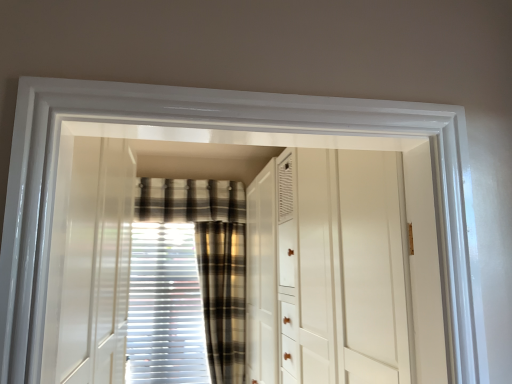
This screenshot has width=512, height=384. What do you see at coordinates (188, 282) in the screenshot?
I see `white textured blinds at center, acting as the 1th curtain starting from the left` at bounding box center [188, 282].

What do you see at coordinates (190, 200) in the screenshot? This screenshot has width=512, height=384. I see `plaid fabric at center` at bounding box center [190, 200].

Looking at this image, measure the distance between plaid fabric curtain at center, which is the 2th curtain in left-to-right order, and camera.

The depth of plaid fabric curtain at center, which is the 2th curtain in left-to-right order, is 3.15 meters.

Describe the element at coordinates (344, 269) in the screenshot. The width and height of the screenshot is (512, 384). I see `white glossy dresser at center` at that location.

You are a GUI agent. You are given a task and a screenshot of the screen. Output one action in this format:
    pyautogui.click(x=<x>, y=<y>)
    Task: Click on the white glossy dresser at center
    This screenshot has width=512, height=384.
    Given the screenshot: What is the action you would take?
    pyautogui.click(x=344, y=269)

The image size is (512, 384). I want to click on white textured blinds at center, acting as the 1th curtain starting from the left, so click(x=188, y=282).

Which object is further away from the camera, plaid fabric curtain at center, the first curtain from the right, or white textured blinds at center, acting as the 1th curtain starting from the left?

white textured blinds at center, acting as the 1th curtain starting from the left, is further from the camera.

Would you consider plaid fabric curtain at center, which is the 2th curtain in left-to-right order, to be distant from white textured blinds at center, acting as the 1th curtain starting from the left?

That's not correct — plaid fabric curtain at center, which is the 2th curtain in left-to-right order, is a little close to white textured blinds at center, acting as the 1th curtain starting from the left.

Can you confirm if plaid fabric curtain at center, which is the 2th curtain in left-to-right order, is shorter than white textured blinds at center, the 2th curtain when ordered from right to left?

No.

Does plaid fabric curtain at center, the first curtain from the right, have a greater width compared to white textured blinds at center, the 2th curtain when ordered from right to left?

Indeed, plaid fabric curtain at center, the first curtain from the right, has a greater width compared to white textured blinds at center, the 2th curtain when ordered from right to left.

Is white glossy dresser at center not within white textured blinds at center, the 2th curtain when ordered from right to left?

Indeed, white glossy dresser at center is completely outside white textured blinds at center, the 2th curtain when ordered from right to left.

Between white glossy dresser at center and white textured blinds at center, the 2th curtain when ordered from right to left, which one appears on the right side from the viewer's perspective?

From the viewer's perspective, white glossy dresser at center appears more on the right side.

Looking at the image, does white glossy dresser at center seem bigger or smaller compared to white textured blinds at center, the 2th curtain when ordered from right to left?

Considering their sizes, white glossy dresser at center takes up more space than white textured blinds at center, the 2th curtain when ordered from right to left.

From the image's perspective, which is above, white glossy dresser at center or white textured blinds at center, the 2th curtain when ordered from right to left?

white glossy dresser at center is shown above in the image.

Is white glossy dresser at center not within plaid fabric at center?

Indeed, white glossy dresser at center is completely outside plaid fabric at center.

Which object is wider, white glossy dresser at center or plaid fabric at center?

With larger width is white glossy dresser at center.

From a real-world perspective, between white glossy dresser at center and plaid fabric at center, who is vertically lower?

white glossy dresser at center is physically lower.

Does point (372, 328) appear closer or farther from the camera than point (200, 195)?

Point (372, 328) appears to be closer to the viewer than point (200, 195).

Is plaid fabric at center in contact with white glossy dresser at center?

plaid fabric at center is not next to white glossy dresser at center, and they're not touching.

From the image's perspective, would you say plaid fabric at center is positioned over white glossy dresser at center?

Yes, from the image's perspective, plaid fabric at center is on top of white glossy dresser at center.

Considering the sizes of plaid fabric at center and white glossy dresser at center in the image, is plaid fabric at center bigger or smaller than white glossy dresser at center?

plaid fabric at center is smaller than white glossy dresser at center.

Is plaid fabric at center further to camera compared to white glossy dresser at center?

Yes, plaid fabric at center is behind white glossy dresser at center.

Is white glossy dresser at center further to camera compared to plaid fabric curtain at center, the first curtain from the right?

No, white glossy dresser at center is closer to the camera.

At what (x,y) coordinates should I click in order to perform the action: click on the 1st curtain below the white glossy dresser at center (from the image's perspective). Please return your answer as a coordinate pair (x, y). Looking at the image, I should click on (223, 296).

Can you confirm if white glossy dresser at center is wider than plaid fabric curtain at center, the first curtain from the right?

Indeed, white glossy dresser at center has a greater width compared to plaid fabric curtain at center, the first curtain from the right.

How many degrees apart are the facing directions of white glossy dresser at center and plaid fabric curtain at center, the first curtain from the right?

The angular difference between white glossy dresser at center and plaid fabric curtain at center, the first curtain from the right, is 90 degrees.

Is white textured blinds at center, the 2th curtain when ordered from right to left, oriented away from plaid fabric at center?

No.

Which object is closer to the camera, white textured blinds at center, acting as the 1th curtain starting from the left, or plaid fabric at center?

white textured blinds at center, acting as the 1th curtain starting from the left, is in front.

From their relative heights in the image, would you say white textured blinds at center, acting as the 1th curtain starting from the left, is taller or shorter than plaid fabric at center?

Considering their sizes, white textured blinds at center, acting as the 1th curtain starting from the left, has more height than plaid fabric at center.

How different are the orientations of plaid fabric at center and plaid fabric curtain at center, the first curtain from the right, in degrees?

They differ by 0.000267 degrees in their facing directions.

Which of these two, plaid fabric at center or plaid fabric curtain at center, which is the 2th curtain in left-to-right order, is thinner?

Thinner between the two is plaid fabric at center.

From the image's perspective, does plaid fabric at center appear higher than plaid fabric curtain at center, which is the 2th curtain in left-to-right order?

Indeed, from the image's perspective, plaid fabric at center is shown above plaid fabric curtain at center, which is the 2th curtain in left-to-right order.

From their relative heights in the image, would you say plaid fabric at center is taller or shorter than plaid fabric curtain at center, the first curtain from the right?

Clearly, plaid fabric at center is shorter compared to plaid fabric curtain at center, the first curtain from the right.

You are a GUI agent. You are given a task and a screenshot of the screen. Output one action in this format:
    pyautogui.click(x=<x>, y=<y>)
    Task: Click on the curtain that appears on the left of plaid fabric curtain at center, which is the 2th curtain in left-to-right order
    
    Given the screenshot: What is the action you would take?
    pyautogui.click(x=188, y=282)

This screenshot has height=384, width=512. In order to click on the 2nd curtain positioned below the white glossy dresser at center (from the image's perspective) in this screenshot , I will do [188, 282].

Which object lies further to the anchor point white textured blinds at center, acting as the 1th curtain starting from the left, plaid fabric curtain at center, which is the 2th curtain in left-to-right order, or white glossy dresser at center?

Based on the image, white glossy dresser at center appears to be further to white textured blinds at center, acting as the 1th curtain starting from the left.

Which object lies further to the anchor point white glossy dresser at center, plaid fabric at center or white textured blinds at center, acting as the 1th curtain starting from the left?

Among the two, plaid fabric at center is located further to white glossy dresser at center.

Which object lies further to the anchor point white textured blinds at center, acting as the 1th curtain starting from the left, plaid fabric at center or white glossy dresser at center?

Based on the image, white glossy dresser at center appears to be further to white textured blinds at center, acting as the 1th curtain starting from the left.

Looking at the image, which one is located closer to white glossy dresser at center, plaid fabric curtain at center, the first curtain from the right, or white textured blinds at center, the 2th curtain when ordered from right to left?

plaid fabric curtain at center, the first curtain from the right.

Estimate the real-world distances between objects in this image. Which object is closer to white glossy dresser at center, white textured blinds at center, acting as the 1th curtain starting from the left, or plaid fabric at center?

white textured blinds at center, acting as the 1th curtain starting from the left.

Considering their positions, is white textured blinds at center, acting as the 1th curtain starting from the left, positioned further to plaid fabric curtain at center, the first curtain from the right, than white glossy dresser at center?

white glossy dresser at center.

Looking at the image, which one is located further to plaid fabric at center, plaid fabric curtain at center, which is the 2th curtain in left-to-right order, or white glossy dresser at center?

The object further to plaid fabric at center is white glossy dresser at center.

In the scene shown: Which object lies nearer to the anchor point plaid fabric curtain at center, which is the 2th curtain in left-to-right order, white textured blinds at center, the 2th curtain when ordered from right to left, or plaid fabric at center?

white textured blinds at center, the 2th curtain when ordered from right to left, lies closer to plaid fabric curtain at center, which is the 2th curtain in left-to-right order, than the other object.

Where is `curtain between plaid fabric at center and white textured blinds at center, the 2th curtain when ordered from right to left, in the up-down direction`? The height and width of the screenshot is (384, 512). curtain between plaid fabric at center and white textured blinds at center, the 2th curtain when ordered from right to left, in the up-down direction is located at coordinates (223, 296).

Locate an element on the screen. This screenshot has width=512, height=384. curtain between white glossy dresser at center and white textured blinds at center, the 2th curtain when ordered from right to left, along the z-axis is located at coordinates tap(223, 296).